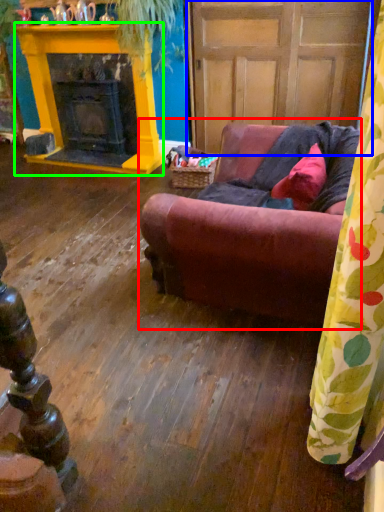
Question: Which object is positioned farthest from studio couch (highlighted by a red box)? Select from door (highlighted by a blue box) and fireplace (highlighted by a green box).

Choices:
 (A) door
 (B) fireplace

Answer: (B)